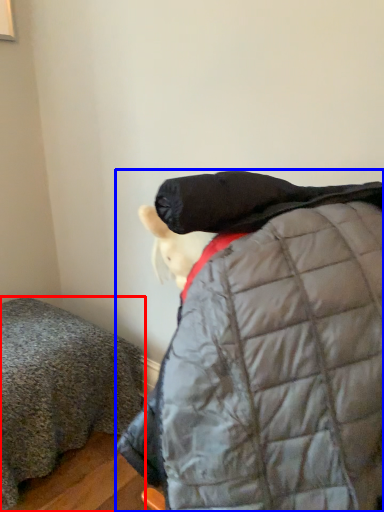
Question: Which object is closer to the camera taking this photo, furniture (highlighted by a red box) or jacket (highlighted by a blue box)?

Choices:
 (A) furniture
 (B) jacket

Answer: (B)